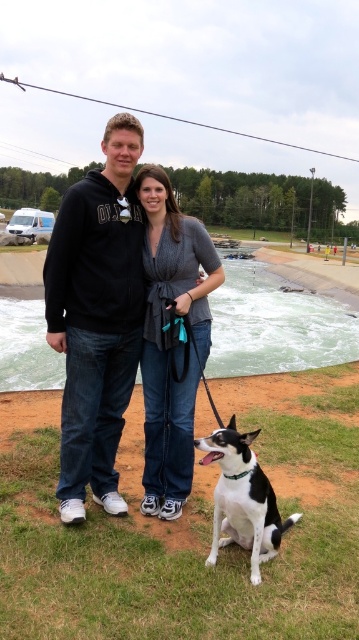
You are a photographer standing in the park. You want to take a picture of the black hoodie at center and the black and white fur at lower center. Which object should you focus on first if you want to capture both in the same frame without moving your camera?

The black hoodie at center is located above the black and white fur at lower center, so you should focus on the black hoodie at center first to ensure both are in the frame.

You are a photographer standing at the center of the image. You need to capture a photo that includes both the denim jeans at center and the point marked at coordinates [171,339]. Can you confirm if the denim jeans at center are exactly at the marked point?

Yes, the point marked at coordinates [171,339] marks denim jeans at center, so they are exactly at the marked point.

In the scene described, there are two people wearing denim jeans at center and black hoodie at center. Which of these two items is positioned to the right side?

The denim jeans at center are positioned to the right of the black hoodie at center.